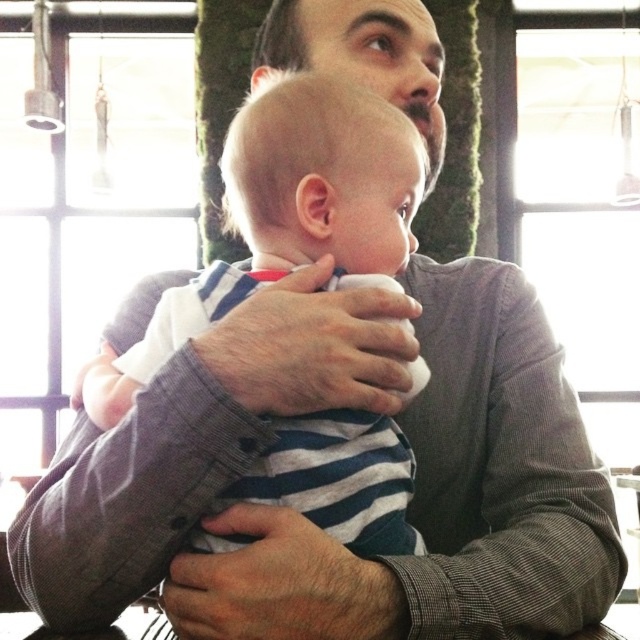
Does gray checkered shirt at center have a larger size compared to white striped shirt at center?

No, gray checkered shirt at center is not bigger than white striped shirt at center.

Does gray checkered shirt at center appear under white striped shirt at center?

Yes, gray checkered shirt at center is below white striped shirt at center.

Does point (401, 605) come in front of point (321, 499)?

Yes, point (401, 605) is closer to viewer.

The height and width of the screenshot is (640, 640). I want to click on gray checkered shirt at center, so click(432, 556).